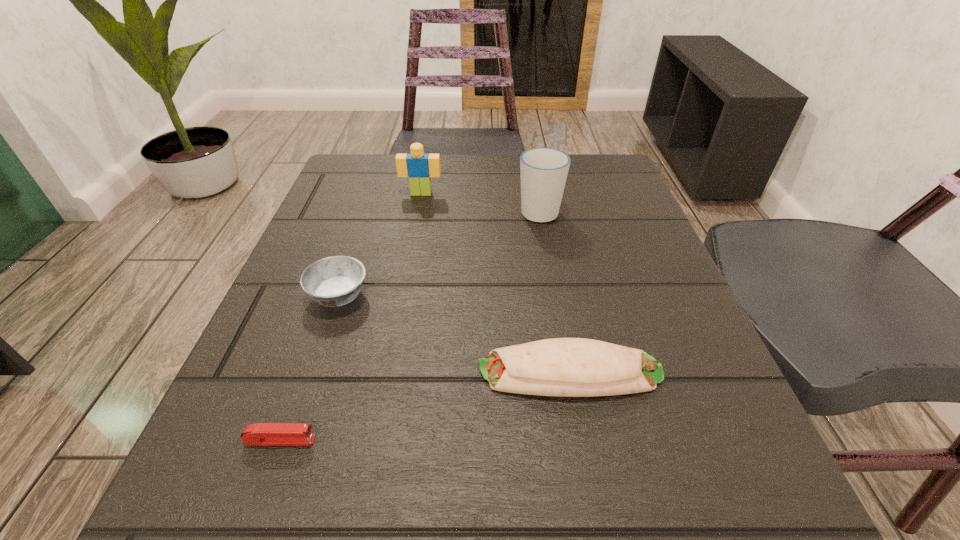
The width and height of the screenshot is (960, 540). Find the location of `ashtray that is positioned at the left edge`. ashtray that is positioned at the left edge is located at coordinates (334, 281).

Where is `stapler at the left edge`? The width and height of the screenshot is (960, 540). stapler at the left edge is located at coordinates (262, 434).

In order to click on cup present at the right edge in this screenshot , I will do `click(543, 170)`.

I want to click on burrito at the right edge, so click(x=569, y=367).

Where is `object situated at the far left corner`? This screenshot has height=540, width=960. object situated at the far left corner is located at coordinates (419, 167).

Identify the location of object present at the far right corner. (543, 170).

In the image, there is a desktop. At what (x,y) coordinates should I click in order to perform the action: click on free region at the far edge. Please return your answer as a coordinate pair (x, y). The width and height of the screenshot is (960, 540). Looking at the image, I should click on (498, 183).

Identify the location of free space at the near edge of the desktop. (452, 469).

This screenshot has height=540, width=960. In order to click on blank space at the left edge of the desktop in this screenshot , I will do (x=335, y=255).

In order to click on vacant space at the right edge in this screenshot , I will do `click(569, 213)`.